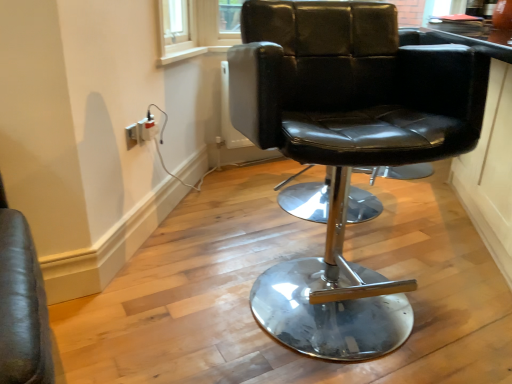
Question: Is white plastic socket at lower left, acting as the 2th electric outlet starting from the front, aimed at white plastic electric outlet at lower left, the 2th electric outlet viewed from the back?

Choices:
 (A) yes
 (B) no

Answer: (B)

Question: Can you confirm if white plastic socket at lower left, acting as the 2th electric outlet starting from the front, is smaller than white plastic electric outlet at lower left, the first electric outlet viewed from the left?

Choices:
 (A) yes
 (B) no

Answer: (B)

Question: Is white plastic socket at lower left, the 1th electric outlet from the back, closer to camera compared to white plastic electric outlet at lower left, the first electric outlet viewed from the left?

Choices:
 (A) no
 (B) yes

Answer: (A)

Question: Is the depth of white plastic socket at lower left, positioned as the second electric outlet in left-to-right order, greater than that of white plastic electric outlet at lower left, the first electric outlet viewed from the left?

Choices:
 (A) yes
 (B) no

Answer: (A)

Question: Are white plastic socket at lower left, positioned as the second electric outlet in left-to-right order, and white plastic electric outlet at lower left, the 2th electric outlet viewed from the back, far apart?

Choices:
 (A) yes
 (B) no

Answer: (B)

Question: From the image's perspective, is white plastic electric outlet at lower left, the first electric outlet viewed from the left, positioned above or below white plastic socket at lower left, acting as the 2th electric outlet starting from the front?

Choices:
 (A) above
 (B) below

Answer: (B)

Question: In the image, is white plastic electric outlet at lower left, the 2th electric outlet viewed from the back, on the left side or the right side of white plastic socket at lower left, acting as the 2th electric outlet starting from the front?

Choices:
 (A) right
 (B) left

Answer: (B)

Question: In terms of size, does white plastic electric outlet at lower left, placed as the 2th electric outlet when sorted from right to left, appear bigger or smaller than white plastic socket at lower left, positioned as the second electric outlet in left-to-right order?

Choices:
 (A) small
 (B) big

Answer: (A)

Question: Is point (131, 127) closer or farther from the camera than point (151, 135)?

Choices:
 (A) closer
 (B) farther

Answer: (A)

Question: Considering the relative positions of black leather chair at center and white plastic electric outlet at lower left, the first electric outlet viewed from the left, in the image provided, is black leather chair at center to the left or to the right of white plastic electric outlet at lower left, the first electric outlet viewed from the left,?

Choices:
 (A) left
 (B) right

Answer: (B)

Question: Does point (374, 349) appear closer or farther from the camera than point (137, 142)?

Choices:
 (A) closer
 (B) farther

Answer: (A)

Question: In the image, is black leather chair at center positioned in front of or behind white plastic electric outlet at lower left, the 2th electric outlet viewed from the back?

Choices:
 (A) front
 (B) behind

Answer: (A)

Question: Is black leather chair at center spatially inside white plastic electric outlet at lower left, placed as the 2th electric outlet when sorted from right to left, or outside of it?

Choices:
 (A) outside
 (B) inside

Answer: (A)

Question: From their relative heights in the image, would you say black leather chair at center is taller or shorter than white plastic socket at lower left, the 1th electric outlet in the right-to-left sequence?

Choices:
 (A) short
 (B) tall

Answer: (B)

Question: Relative to white plastic socket at lower left, positioned as the second electric outlet in left-to-right order, is black leather chair at center in front or behind?

Choices:
 (A) behind
 (B) front

Answer: (B)